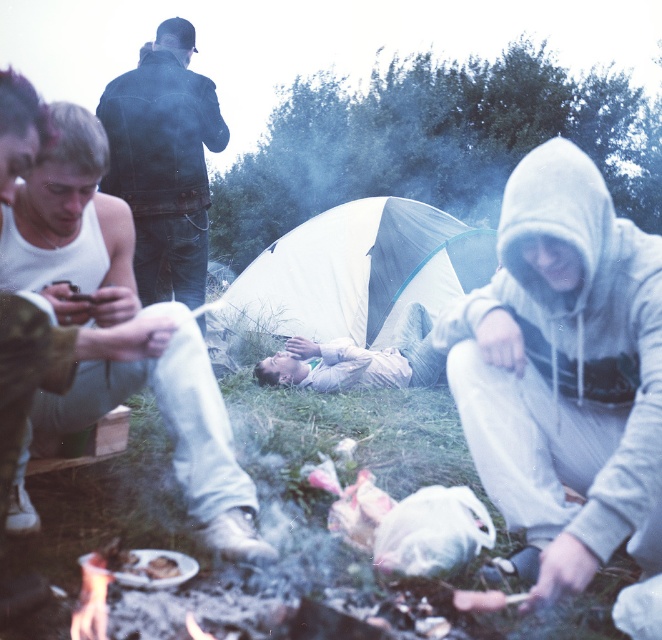
You are a hiker who just arrived at the campsite and need to set up your tent. You see the white fabric tent at center and the dark blue leather jacket at upper left. Which object is bigger?

The white fabric tent at center is larger in size than the dark blue leather jacket at upper left.

You are a photographer trying to capture a photo of the light gray hoodie at lower right and the dark blue leather jacket at upper left. Based on their positions, which object should you focus on first if you want to include both in the same frame without moving the camera?

The light gray hoodie at lower right is located below the dark blue leather jacket at upper left. To include both in the same frame without moving the camera, you should focus on the dark blue leather jacket at upper left first, as it is higher up, ensuring both are within the camera view.

Consider the image. You are a photographer trying to capture a wide shot of the camping scene. You notice the dark blue leather jacket at upper left and the light gray hoodie at center. Which clothing item would require you to zoom in more to include its details in the photo?

The dark blue leather jacket at upper left has a smaller width compared to the light gray hoodie at center. Since it is smaller, you would need to zoom in more to capture its details clearly.